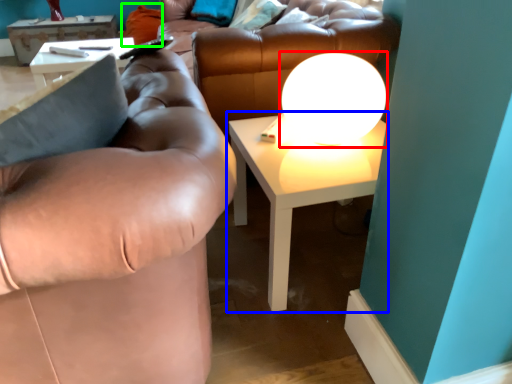
Question: Based on their relative distances, which object is nearer to table lamp (highlighted by a red box)? Choose from table (highlighted by a blue box) and pillow (highlighted by a green box).

Choices:
 (A) table
 (B) pillow

Answer: (A)